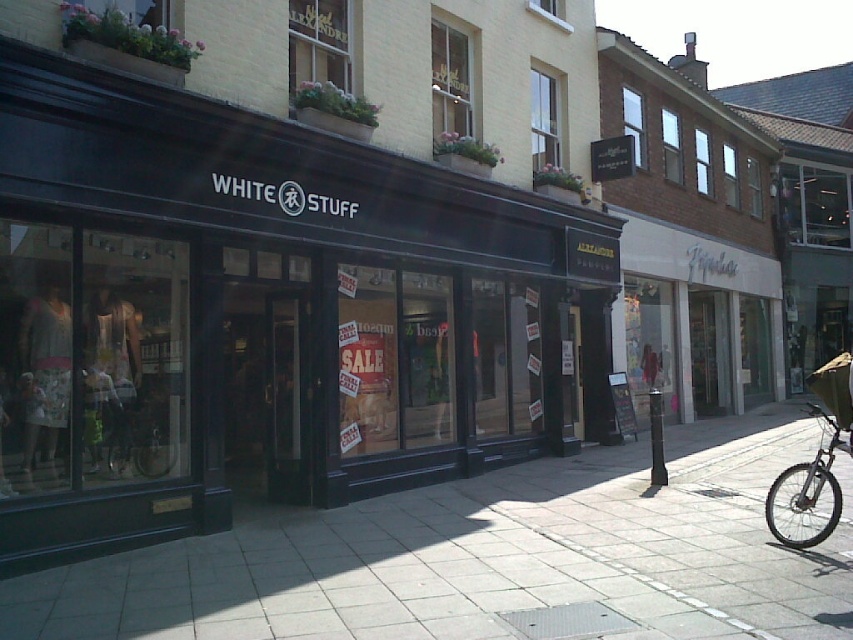
Question: Based on their relative distances, which object is nearer to the smooth concrete pavement at center?

Choices:
 (A) green fabric bicycle at center
 (B) black matte storefront at center
 (C) silver metallic bicycle at lower right

Answer: (A)

Question: Is black matte storefront at center positioned at the back of smooth concrete pavement at center?

Choices:
 (A) no
 (B) yes

Answer: (B)

Question: Among these points, which one is farthest from the camera?

Choices:
 (A) tap(811, 577)
 (B) tap(155, 456)
 (C) tap(779, 529)
 (D) tap(341, 412)

Answer: (D)

Question: Does black matte storefront at center appear over smooth concrete pavement at center?

Choices:
 (A) no
 (B) yes

Answer: (B)

Question: Which point is farther to the camera?

Choices:
 (A) (83, 426)
 (B) (74, 433)

Answer: (A)

Question: Is black matte storefront at center further to the viewer compared to green fabric bicycle at center?

Choices:
 (A) yes
 (B) no

Answer: (B)